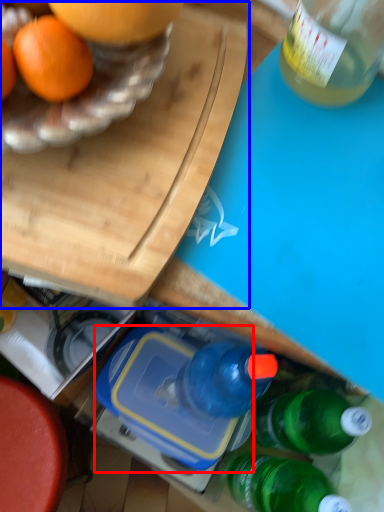
Question: Which of the following is the farthest to the observer, lunch box (highlighted by a red box) or cutting board (highlighted by a blue box)?

Choices:
 (A) lunch box
 (B) cutting board

Answer: (A)